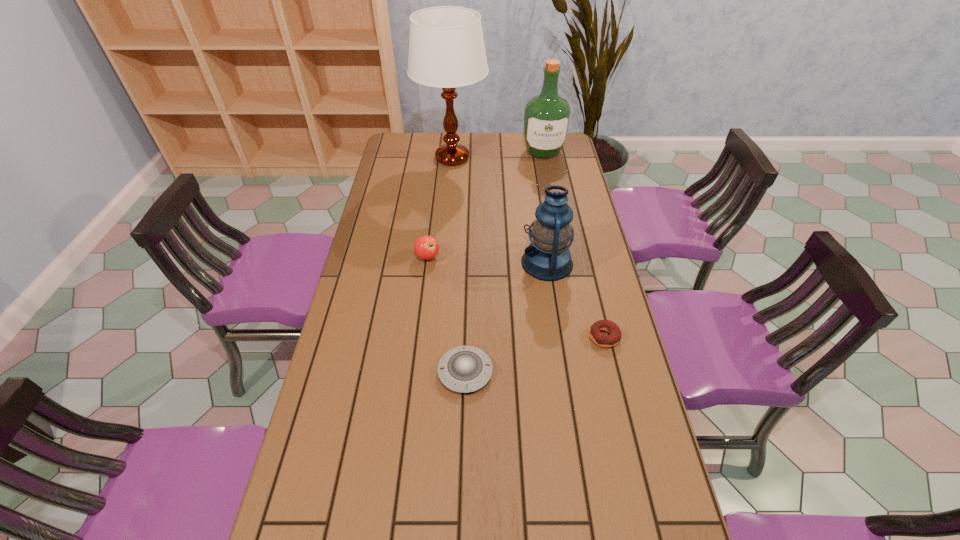
This screenshot has height=540, width=960. I want to click on free space that satisfies the following two spatial constraints: 1. on the face of the doughnut; 2. on the left side of the lantern, so click(558, 337).

I want to click on vacant space that satisfies the following two spatial constraints: 1. on the face of the doughnut; 2. on the left side of the third tallest object, so click(558, 337).